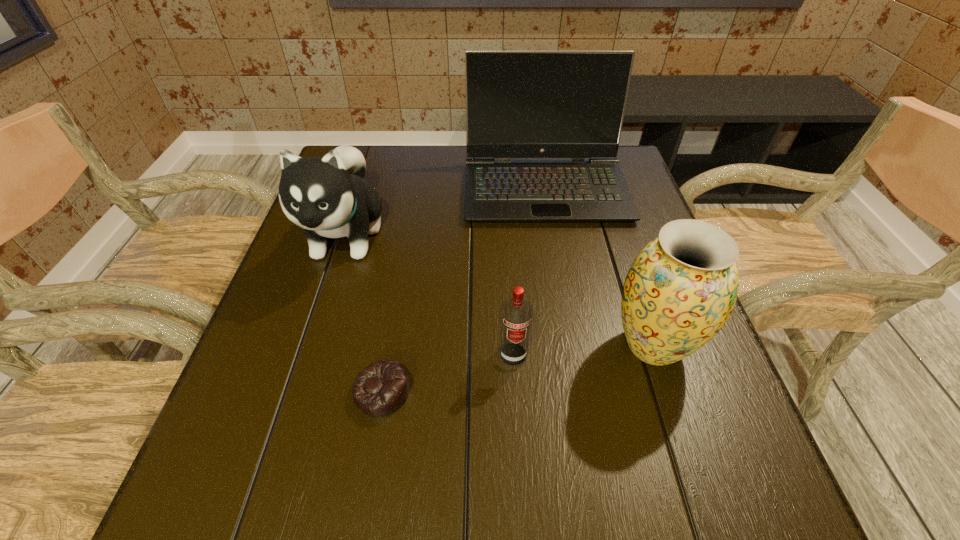
Locate an element on the screen. vacant area situated 0.340m on the right of the second object from left to right is located at coordinates (604, 392).

At what (x,y) coordinates should I click in order to perform the action: click on object that is at the far edge. Please return your answer as a coordinate pair (x, y). Looking at the image, I should click on (519, 104).

This screenshot has width=960, height=540. Find the location of `object located at the left edge`. object located at the left edge is located at coordinates (328, 197).

The image size is (960, 540). I want to click on laptop computer that is at the right edge, so click(519, 104).

The width and height of the screenshot is (960, 540). What are the coordinates of `vase at the right edge` in the screenshot? It's located at (680, 290).

Where is `object present at the far right corner`? The height and width of the screenshot is (540, 960). object present at the far right corner is located at coordinates (519, 104).

You are a GUI agent. You are given a task and a screenshot of the screen. Output one action in this format:
    pyautogui.click(x=<x>, y=<y>)
    Task: Click on the free space at the far edge of the desktop
    
    Given the screenshot: What is the action you would take?
    pyautogui.click(x=412, y=185)

Locate an element on the screen. This screenshot has width=960, height=540. vacant space at the left edge of the desktop is located at coordinates (295, 304).

The image size is (960, 540). In order to click on blank space at the right edge of the desktop in this screenshot , I will do `click(648, 211)`.

Locate an element on the screen. This screenshot has height=540, width=960. vacant area at the far left corner is located at coordinates click(x=381, y=166).